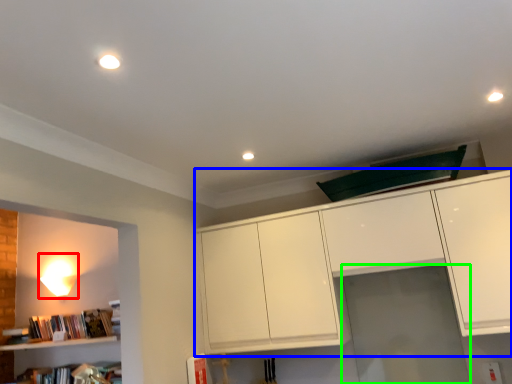
Question: Based on their relative distances, which object is nearer to lamp (highlighted by a red box)? Choose from cabinetry (highlighted by a blue box) and glass door (highlighted by a green box).

Choices:
 (A) cabinetry
 (B) glass door

Answer: (A)